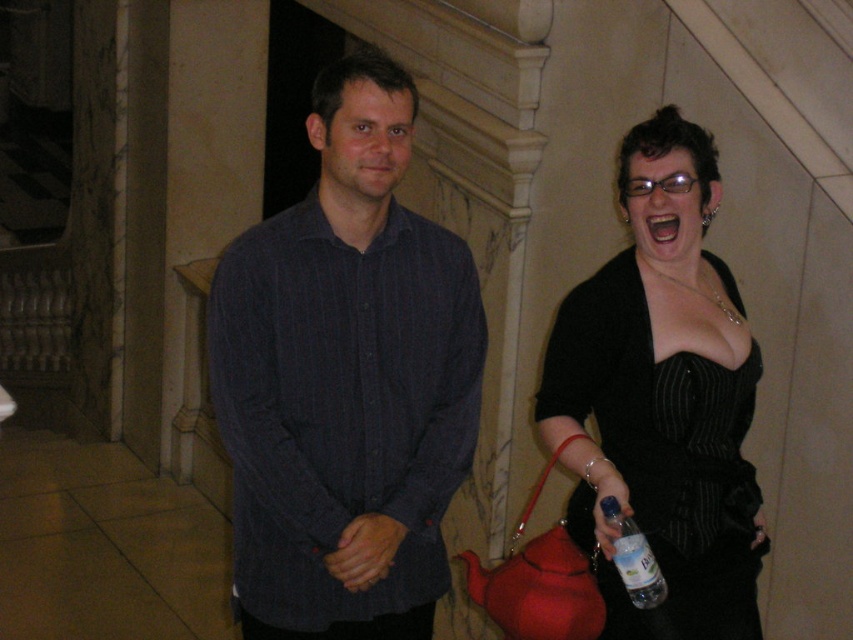
Does black satin dress at right appear under clear plastic bottle at lower right?

Actually, black satin dress at right is above clear plastic bottle at lower right.

Who is shorter, black satin dress at right or clear plastic bottle at lower right?

Standing shorter between the two is clear plastic bottle at lower right.

Describe the element at coordinates (662, 396) in the screenshot. I see `black satin dress at right` at that location.

Image resolution: width=853 pixels, height=640 pixels. In order to click on black satin dress at right in this screenshot , I will do `click(662, 396)`.

Does dark blue striped shirt at center lie in front of black satin dress at right?

No, it is behind black satin dress at right.

Which is above, dark blue striped shirt at center or black satin dress at right?

dark blue striped shirt at center

Is point (364, 324) positioned in front of point (659, 369)?

No, it is behind (659, 369).

The image size is (853, 640). I want to click on dark blue striped shirt at center, so click(345, 380).

Can you confirm if dark blue striped shirt at center is positioned below clear plastic bottle at lower right?

No.

Locate an element on the screen. The image size is (853, 640). dark blue striped shirt at center is located at coordinates tap(345, 380).

Who is more distant from viewer, (279, 461) or (635, 588)?

The point (279, 461) is more distant.

This screenshot has width=853, height=640. Find the location of `dark blue striped shirt at center`. dark blue striped shirt at center is located at coordinates (345, 380).